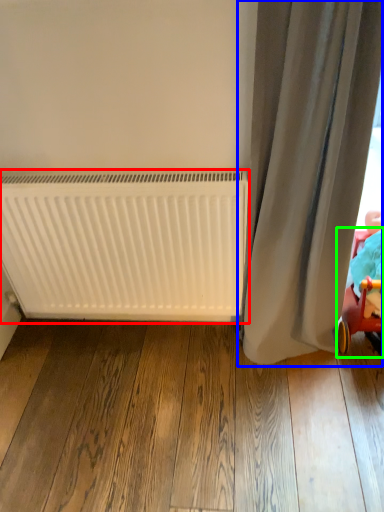
Question: Which object is positioned farthest from radiator (highlighted by a red box)? Select from curtain (highlighted by a blue box) and baby carriage (highlighted by a green box).

Choices:
 (A) curtain
 (B) baby carriage

Answer: (B)